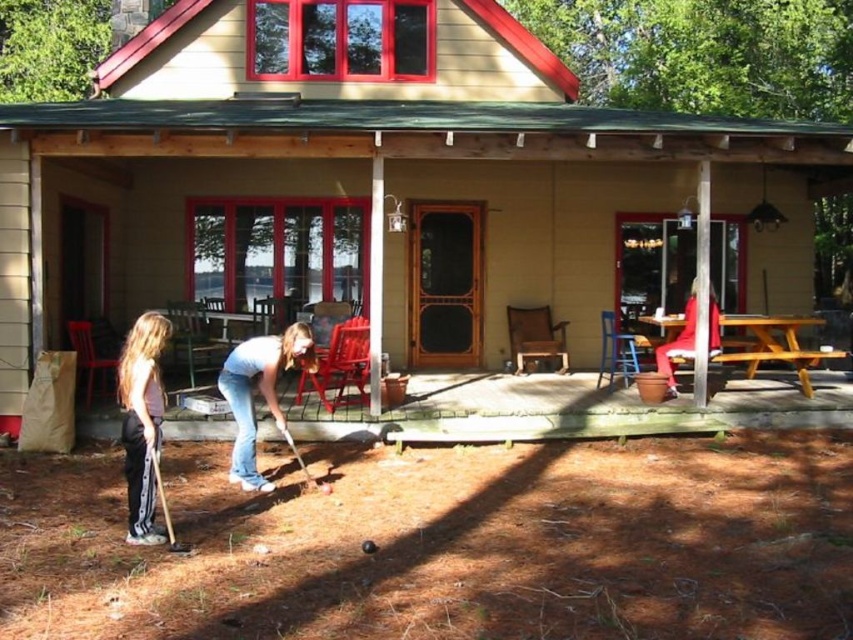
Question: In this image, where is beige stucco cabin at center located relative to light pink cotton shirt at left?

Choices:
 (A) below
 (B) above

Answer: (B)

Question: Which of the following is the closest to the observer?

Choices:
 (A) blue jeans at center
 (B) wooden picnic table at center
 (C) light pink cotton shirt at left
 (D) red fabric chair at right

Answer: (C)

Question: Estimate the real-world distances between objects in this image. Which object is farther from the blue jeans at center?

Choices:
 (A) wooden picnic table at center
 (B) beige stucco cabin at center

Answer: (A)

Question: Does beige stucco cabin at center come in front of light pink cotton shirt at left?

Choices:
 (A) yes
 (B) no

Answer: (B)

Question: Does light pink cotton shirt at left have a lesser width compared to red fabric chair at right?

Choices:
 (A) no
 (B) yes

Answer: (B)

Question: Which of the following is the farthest from the observer?

Choices:
 (A) light pink cotton shirt at left
 (B) blue jeans at center

Answer: (B)